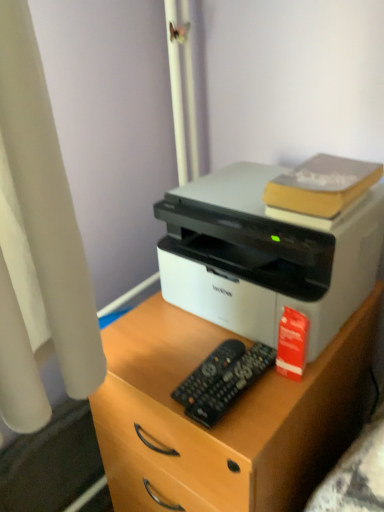
Question: Does black plastic remote at center, marked as the second control in a back-to-front arrangement, have a greater height compared to red matte book at right, marked as the second book in a top-to-bottom arrangement?

Choices:
 (A) no
 (B) yes

Answer: (A)

Question: Would you say black plastic remote at center, the 1th control positioned from the front, contains red matte book at right, the 1th book ordered from the bottom?

Choices:
 (A) yes
 (B) no

Answer: (B)

Question: Does black plastic remote at center, marked as the second control in a back-to-front arrangement, turn towards red matte book at right, marked as the second book in a top-to-bottom arrangement?

Choices:
 (A) no
 (B) yes

Answer: (A)

Question: Is black plastic remote at center, the 1th control positioned from the front, positioned in front of red matte book at right, marked as the second book in a top-to-bottom arrangement?

Choices:
 (A) no
 (B) yes

Answer: (B)

Question: From a real-world perspective, is black plastic remote at center, marked as the second control in a back-to-front arrangement, physically above red matte book at right, marked as the second book in a top-to-bottom arrangement?

Choices:
 (A) no
 (B) yes

Answer: (A)

Question: Looking at their shapes, would you say yellow matte book at upper right, the 2th book ordered from the bottom, is wider or thinner than white matte printer at center?

Choices:
 (A) wide
 (B) thin

Answer: (B)

Question: Looking at the image, does yellow matte book at upper right, arranged as the 1th book when viewed from the top, seem bigger or smaller compared to white matte printer at center?

Choices:
 (A) small
 (B) big

Answer: (A)

Question: Does point (312, 210) appear closer or farther from the camera than point (365, 334)?

Choices:
 (A) closer
 (B) farther

Answer: (A)

Question: Would you say yellow matte book at upper right, the 2th book ordered from the bottom, is inside or outside white matte printer at center?

Choices:
 (A) inside
 (B) outside

Answer: (B)

Question: Is point (321, 283) closer or farther from the camera than point (220, 415)?

Choices:
 (A) closer
 (B) farther

Answer: (B)

Question: From their relative heights in the image, would you say white matte printer at center is taller or shorter than black plastic remote at center, the 1th control positioned from the front?

Choices:
 (A) tall
 (B) short

Answer: (A)

Question: Is white matte printer at center wider or thinner than black plastic remote at center, marked as the second control in a back-to-front arrangement?

Choices:
 (A) thin
 (B) wide

Answer: (B)

Question: Is white matte printer at center bigger or smaller than black plastic remote at center, marked as the second control in a back-to-front arrangement?

Choices:
 (A) big
 (B) small

Answer: (A)

Question: Is red matte book at right, marked as the second book in a top-to-bottom arrangement, in front of or behind white matte printer at center in the image?

Choices:
 (A) behind
 (B) front

Answer: (A)

Question: From the image's perspective, is red matte book at right, the 1th book ordered from the bottom, above or below white matte printer at center?

Choices:
 (A) above
 (B) below

Answer: (A)